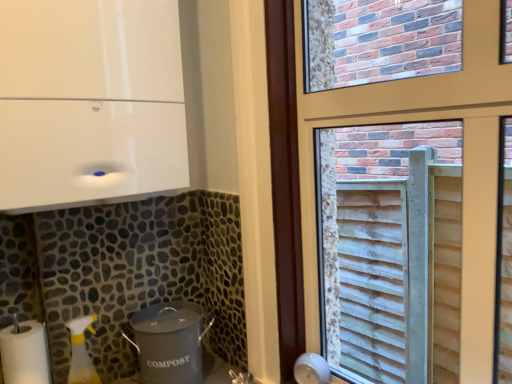
Question: Is gray matte compost bin at lower center, which is counted as the 1th appliance, starting from the bottom, to the right of wooden slats at right from the viewer's perspective?

Choices:
 (A) yes
 (B) no

Answer: (B)

Question: From the image's perspective, is gray matte compost bin at lower center, which is counted as the 1th appliance, starting from the bottom, on top of wooden slats at right?

Choices:
 (A) no
 (B) yes

Answer: (A)

Question: Is gray matte compost bin at lower center, which is counted as the 1th appliance, starting from the bottom, looking in the opposite direction of wooden slats at right?

Choices:
 (A) yes
 (B) no

Answer: (B)

Question: Considering the relative sizes of gray matte compost bin at lower center, the 2th appliance viewed from the top, and wooden slats at right in the image provided, is gray matte compost bin at lower center, the 2th appliance viewed from the top, taller than wooden slats at right?

Choices:
 (A) yes
 (B) no

Answer: (B)

Question: From a real-world perspective, is gray matte compost bin at lower center, the 2th appliance viewed from the top, below wooden slats at right?

Choices:
 (A) no
 (B) yes

Answer: (B)

Question: Considering the positions of point (140, 362) and point (284, 365), is point (140, 362) closer or farther from the camera than point (284, 365)?

Choices:
 (A) farther
 (B) closer

Answer: (B)

Question: In the image, is gray matte compost bin at lower center, which is counted as the 1th appliance, starting from the bottom, positioned in front of or behind wooden slats at right?

Choices:
 (A) behind
 (B) front

Answer: (A)

Question: Looking at their shapes, would you say gray matte compost bin at lower center, the 2th appliance viewed from the top, is wider or thinner than wooden slats at right?

Choices:
 (A) thin
 (B) wide

Answer: (B)

Question: From their relative heights in the image, would you say gray matte compost bin at lower center, the 2th appliance viewed from the top, is taller or shorter than wooden slats at right?

Choices:
 (A) tall
 (B) short

Answer: (B)

Question: Considering the positions of white matte paper towel at lower left and white glossy cabinet at upper left, which is counted as the first appliance, starting from the top, in the image, is white matte paper towel at lower left taller or shorter than white glossy cabinet at upper left, which is counted as the first appliance, starting from the top,?

Choices:
 (A) tall
 (B) short

Answer: (B)

Question: Does point (27, 347) appear closer or farther from the camera than point (116, 125)?

Choices:
 (A) closer
 (B) farther

Answer: (B)

Question: Would you say white matte paper towel at lower left is inside or outside white glossy cabinet at upper left, which is counted as the first appliance, starting from the top?

Choices:
 (A) outside
 (B) inside

Answer: (A)

Question: In terms of size, does white matte paper towel at lower left appear bigger or smaller than white glossy cabinet at upper left, which appears as the 2th appliance when ordered from the bottom?

Choices:
 (A) small
 (B) big

Answer: (A)

Question: In terms of width, does white glossy cabinet at upper left, which is counted as the first appliance, starting from the top, look wider or thinner when compared to white matte paper towel at lower left?

Choices:
 (A) wide
 (B) thin

Answer: (A)

Question: In terms of size, does white glossy cabinet at upper left, which appears as the 2th appliance when ordered from the bottom, appear bigger or smaller than white matte paper towel at lower left?

Choices:
 (A) big
 (B) small

Answer: (A)